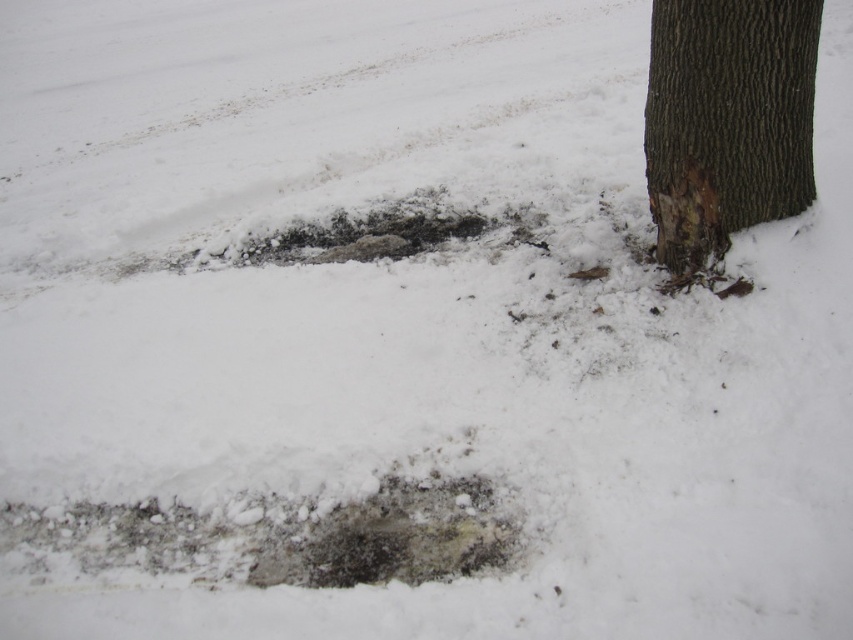
Is point (749, 120) more distant than point (408, 540)?

That is True.

Measure the distance from brown rough bark at right to dark gray stone hole at center.

2.32 meters

What do you see at coordinates (727, 120) in the screenshot?
I see `brown rough bark at right` at bounding box center [727, 120].

Locate an element on the screen. The width and height of the screenshot is (853, 640). brown rough bark at right is located at coordinates (727, 120).